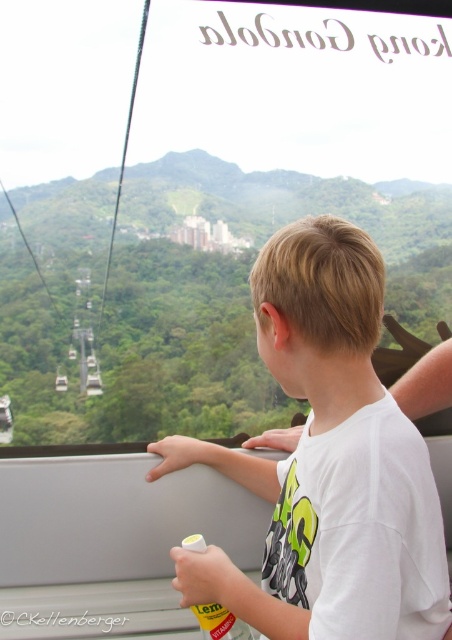
Question: Which of the following is the farthest from the observer?

Choices:
 (A) yellow plastic bottle at lower center
 (B) white cotton shirt at center

Answer: (A)

Question: Among these objects, which one is farthest from the camera?

Choices:
 (A) yellow plastic bottle at lower center
 (B) white cotton shirt at center

Answer: (A)

Question: Observing the image, what is the correct spatial positioning of white cotton shirt at center in reference to yellow plastic bottle at lower center?

Choices:
 (A) left
 (B) right

Answer: (B)

Question: Is white cotton shirt at center thinner than yellow plastic bottle at lower center?

Choices:
 (A) yes
 (B) no

Answer: (B)

Question: Can you confirm if white cotton shirt at center is wider than yellow plastic bottle at lower center?

Choices:
 (A) yes
 (B) no

Answer: (A)